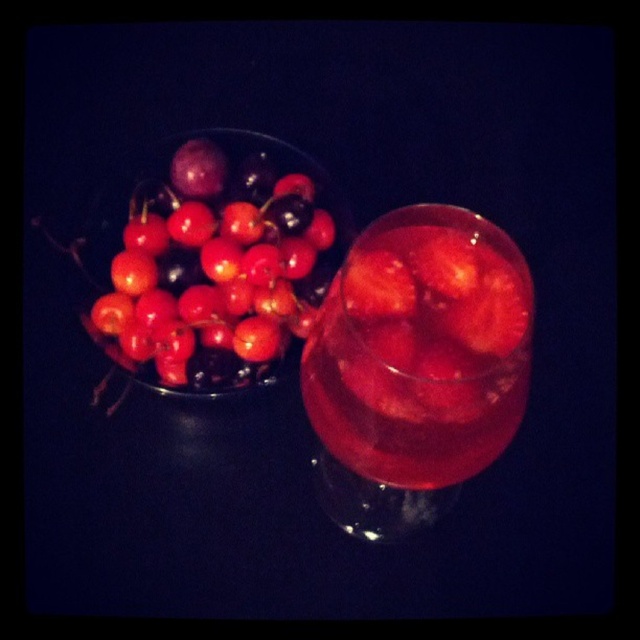
Question: Considering the relative positions of translucent glass at center and shiny red cherries at upper left in the image provided, where is translucent glass at center located with respect to shiny red cherries at upper left?

Choices:
 (A) below
 (B) above

Answer: (A)

Question: Is translucent glass at center below shiny red cherries at upper left?

Choices:
 (A) yes
 (B) no

Answer: (A)

Question: Among these objects, which one is farthest from the camera?

Choices:
 (A) shiny red cherries at upper left
 (B) translucent glass at center

Answer: (A)

Question: Which point is farther from the camera taking this photo?

Choices:
 (A) (122, 307)
 (B) (410, 216)

Answer: (A)

Question: Is translucent glass at center below shiny red cherries at upper left?

Choices:
 (A) no
 (B) yes

Answer: (B)